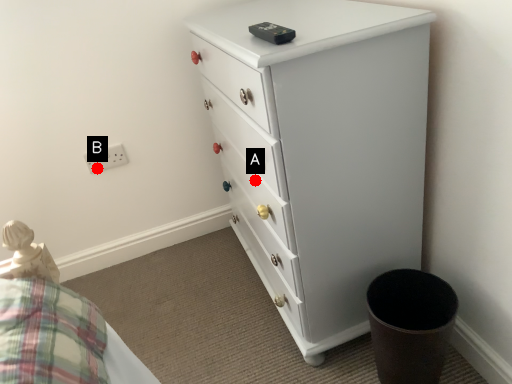
Question: Two points are circled on the image, labeled by A and B beside each circle. Which point appears closest to the camera in this image?

Choices:
 (A) A is closer
 (B) B is closer

Answer: (A)